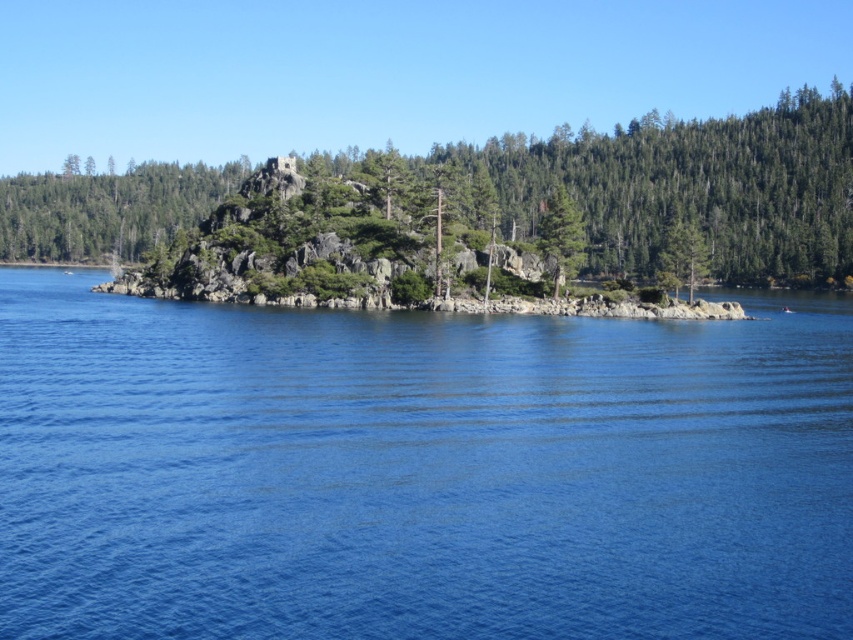
Question: Which of the following is the farthest from the observer?

Choices:
 (A) green matte tree at upper center
 (B) green matte tree at center
 (C) blue water at center

Answer: (A)

Question: In this image, where is green textured rock at center located relative to green matte tree at center?

Choices:
 (A) below
 (B) above

Answer: (B)

Question: Which object is the closest to the blue water at center?

Choices:
 (A) green matte tree at center
 (B) green matte tree at upper center

Answer: (A)

Question: Among these objects, which one is farthest from the camera?

Choices:
 (A) green textured rock at center
 (B) green matte tree at upper center
 (C) green matte tree at center
 (D) blue water at center

Answer: (A)

Question: From the image, what is the correct spatial relationship of blue water at center in relation to green textured rock at center?

Choices:
 (A) above
 (B) below

Answer: (B)

Question: Is green textured rock at center bigger than green matte tree at upper center?

Choices:
 (A) no
 (B) yes

Answer: (B)